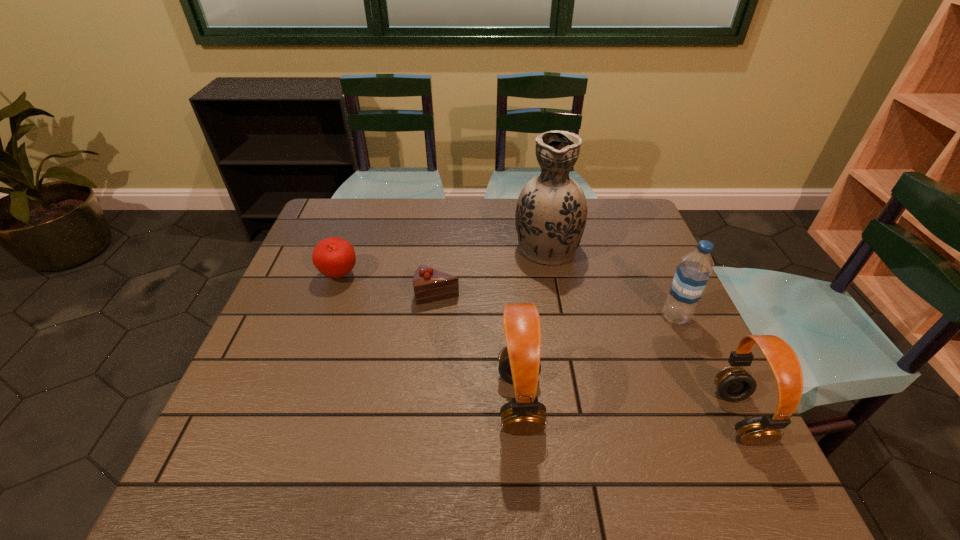
I want to click on water bottle positioned at the right edge, so click(692, 274).

In order to click on object located in the near right corner section of the desktop in this screenshot , I will do `click(734, 384)`.

I want to click on vacant position at the far edge of the desktop, so click(474, 218).

Where is `free space at the near edge`? free space at the near edge is located at coordinates (315, 418).

The image size is (960, 540). In order to click on free space at the left edge of the desktop in this screenshot , I will do `click(309, 244)`.

I want to click on vacant space at the right edge of the desktop, so click(x=663, y=319).

In the image, there is a desktop. Where is `vacant area at the far left corner`? The image size is (960, 540). vacant area at the far left corner is located at coordinates (327, 233).

The image size is (960, 540). Identify the location of vacant space at the near right corner of the desktop. (718, 436).

Identify the location of free space between the third nearest object and the shorter headset. The image size is (960, 540). (708, 367).

You are a GUI agent. You are given a task and a screenshot of the screen. Output one action in this format:
    pyautogui.click(x=<x>, y=<y>)
    Task: Click on the vacant space that's between the shorter headset and the water bottle
    The image size is (960, 540).
    Given the screenshot: What is the action you would take?
    pyautogui.click(x=708, y=367)